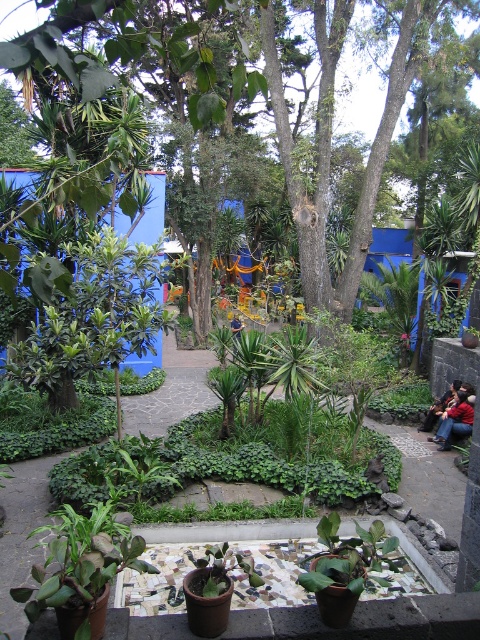
Question: Which object is closer to the camera taking this photo?

Choices:
 (A) dark blue jeans at lower right
 (B) red leather jacket at lower right

Answer: (B)

Question: Does red leather jacket at lower right appear under dark blue jeans at lower right?

Choices:
 (A) yes
 (B) no

Answer: (A)

Question: Which point is closer to the camera?

Choices:
 (A) (444, 429)
 (B) (421, 422)

Answer: (A)

Question: Does red leather jacket at lower right have a larger size compared to dark blue jeans at lower right?

Choices:
 (A) no
 (B) yes

Answer: (A)

Question: Is red leather jacket at lower right in front of dark blue jeans at lower right?

Choices:
 (A) no
 (B) yes

Answer: (B)